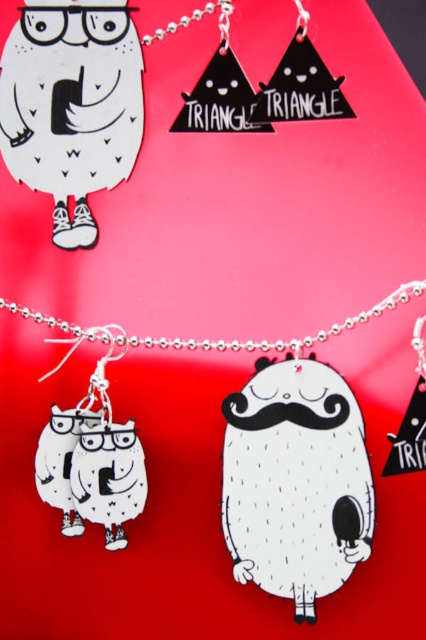
You are a customer at a jewelry store and want to know if the matte black owl at upper left will fit into a necklace holder designed for items shorter than the silver metallic chain at center. Based on the scene description, will it fit?

The matte black owl at upper left is taller than the silver metallic chain at center, so it will not fit into a necklace holder designed for items shorter than the silver metallic chain at center.

You are a customer at a jewelry store and want to examine the silver metallic chain at center closely. If your hand can reach up to 3 feet, can you touch it without moving the display?

The silver metallic chain at center is 3.66 feet away from the viewer, which is beyond the 3 feet reach of your hand. Therefore, you cannot touch it without moving the display.

You are a customer at a jewelry store and want to know which point is closer to you when looking at the display. Can you tell me which point is closer between point (57, 113) and point (74, 348)?

Point (57, 113) is closer to the camera than point (74, 348).